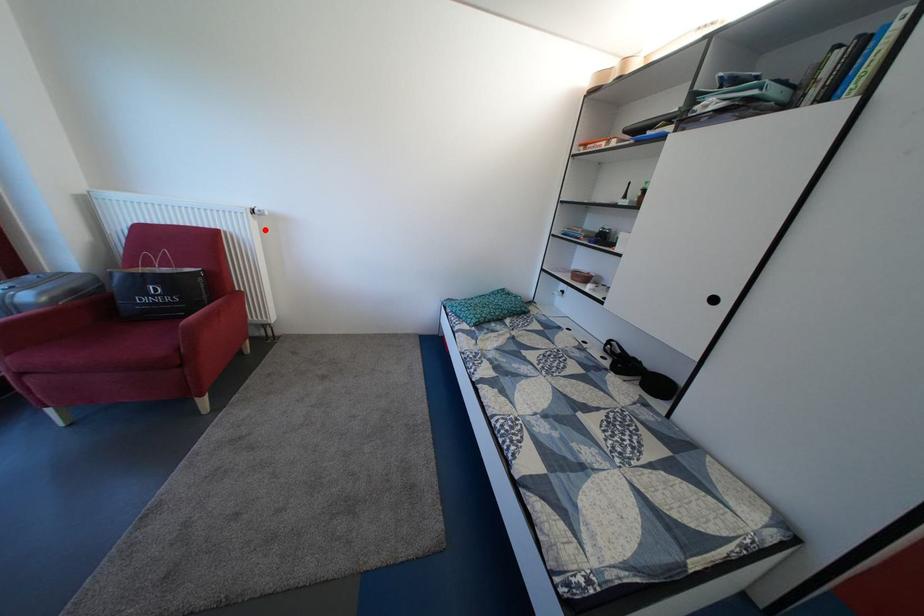
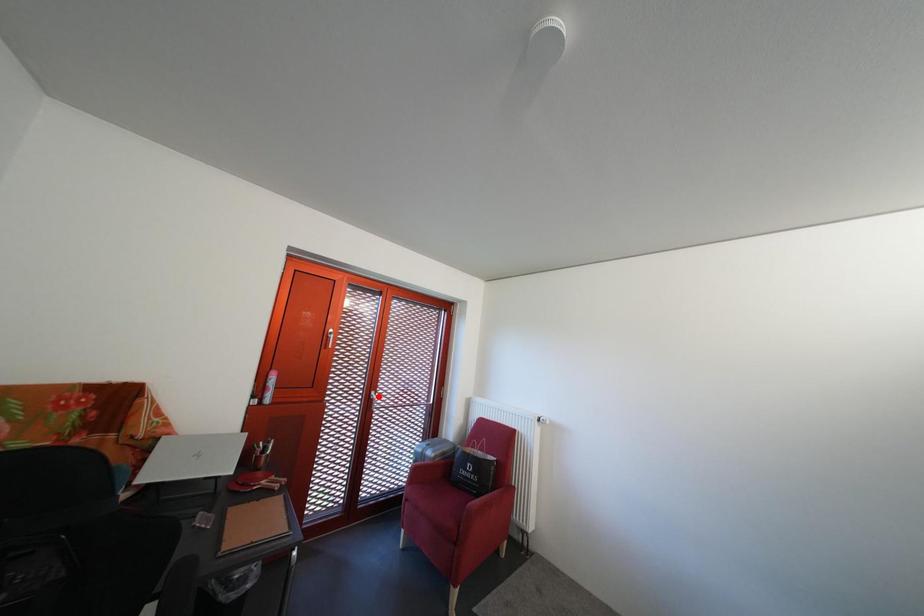
I am providing you with two images of the same scene from different viewpoints. A red point is marked on the first image and another point is marked on the second image. Do the highlighted points in image1 and image2 indicate the same real-world spot?

No